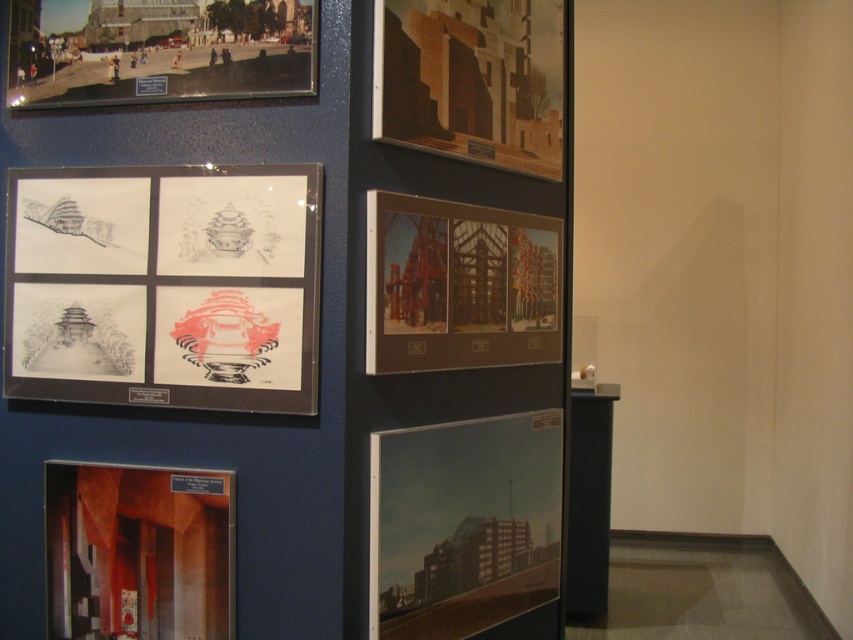
Does matte paper drawings at center left appear over matte glass building at lower center?

Yes, matte paper drawings at center left is above matte glass building at lower center.

At what (x,y) coordinates should I click in order to perform the action: click on matte paper drawings at center left. Please return your answer as a coordinate pair (x, y). Looking at the image, I should click on (164, 285).

Who is lower down, matte brown wooden frame at center or matte black photograph at upper left?

Positioned lower is matte brown wooden frame at center.

What do you see at coordinates (459, 285) in the screenshot?
I see `matte brown wooden frame at center` at bounding box center [459, 285].

What are the coordinates of `matte brown wooden frame at center` in the screenshot? It's located at (459, 285).

Identify the location of matte brown wooden frame at center. (459, 285).

Which is more to the right, matte black photograph at upper left or wooden panel at upper center?

From the viewer's perspective, wooden panel at upper center appears more on the right side.

Measure the distance between matte black photograph at upper left and wooden panel at upper center.

The distance of matte black photograph at upper left from wooden panel at upper center is 23.05 inches.

Where is `matte black photograph at upper left`? This screenshot has height=640, width=853. matte black photograph at upper left is located at coordinates (158, 49).